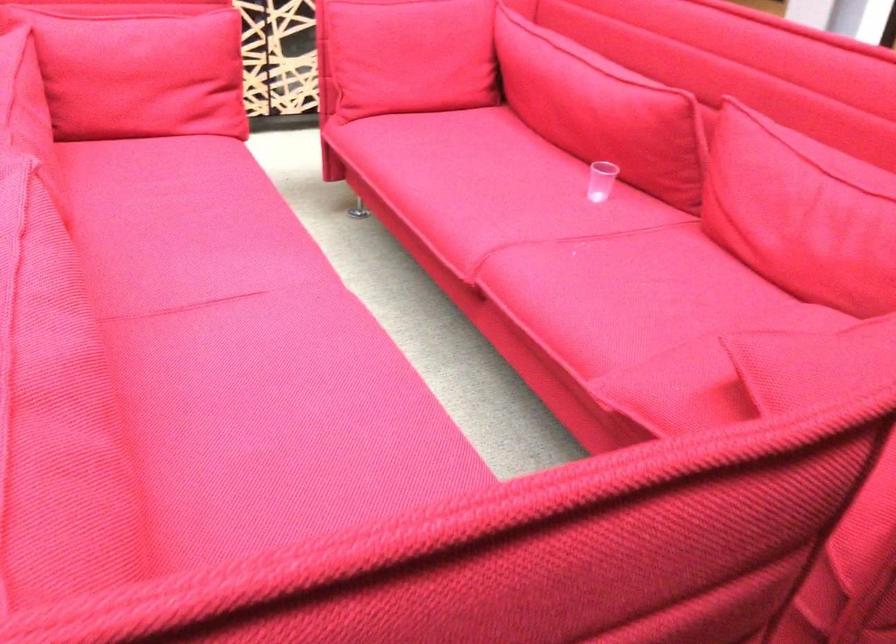
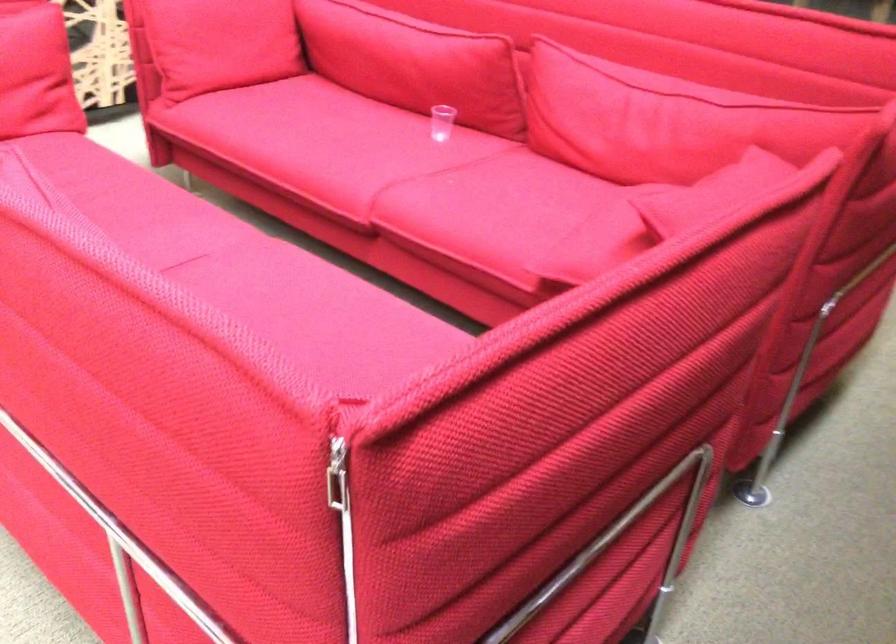
The point at (592, 109) is marked in the first image. Where is the corresponding point in the second image?

(414, 62)